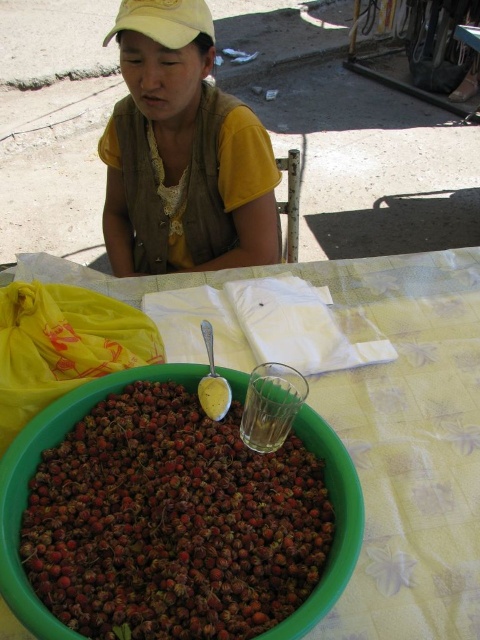
Question: Is red matte berries at center smaller than yellow cotton shirt at upper center?

Choices:
 (A) yes
 (B) no

Answer: (A)

Question: Which point appears closest to the camera in this image?

Choices:
 (A) (274, 616)
 (B) (184, 234)
 (C) (165, 330)

Answer: (A)

Question: Is yellow fabric at center wider than yellow cotton shirt at upper center?

Choices:
 (A) no
 (B) yes

Answer: (B)

Question: Which object is farther from the camera taking this photo?

Choices:
 (A) yellow fabric at center
 (B) yellow cotton shirt at upper center
 (C) red matte berries at center

Answer: (B)

Question: Does yellow fabric at center appear on the right side of yellow cotton shirt at upper center?

Choices:
 (A) yes
 (B) no

Answer: (A)

Question: Estimate the real-world distances between objects in this image. Which object is closer to the red matte berries at center?

Choices:
 (A) yellow cotton shirt at upper center
 (B) yellow fabric at center

Answer: (B)